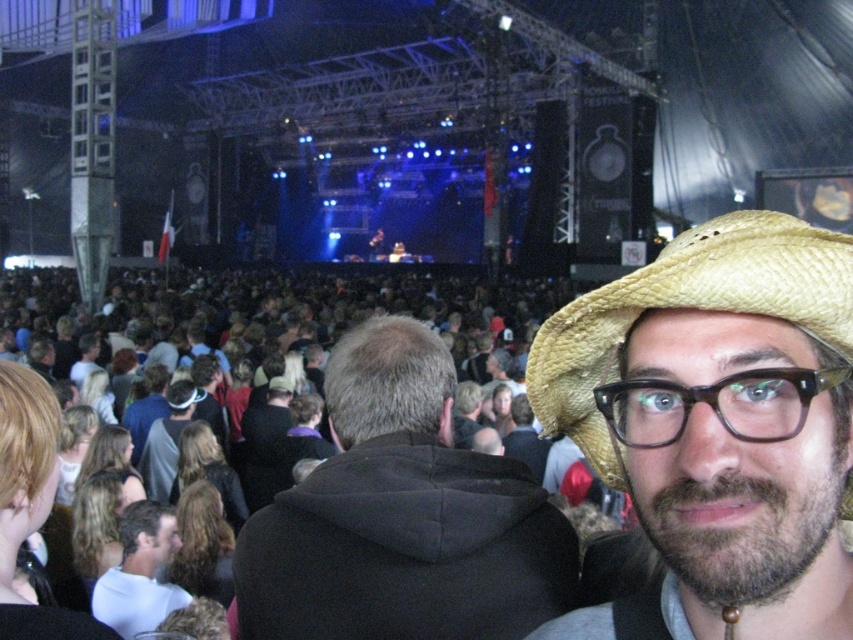
You are at a concert and want to take a photo of the person at the center. The black plastic glasses at center and the white matte shirt at center are both in the frame. Which object should you focus on first if you want to ensure both are in focus?

You should focus on the white matte shirt at center first because the black plastic glasses at center are to the right of it, so adjusting focus starting from the closer object ensures both are in focus.

You are a photographer at the concert and want to take a closeup shot of the person at center. The black plastic glasses at center and white matte shirt at center are both in the frame. Which object should you zoom in on to ensure it takes up more space in the photo?

The white matte shirt at center should be zoomed in on because it is larger than the black plastic glasses at center, so it will take up more space in the photo.